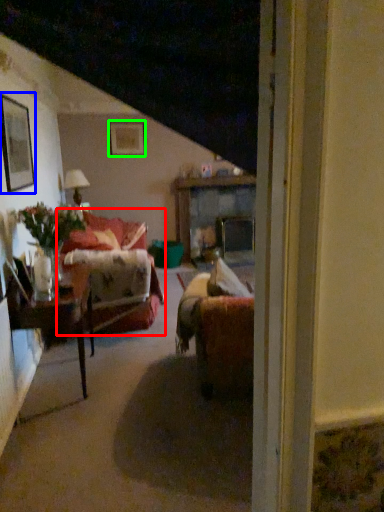
Question: Based on their relative distances, which object is farther from studio couch (highlighted by a red box)? Choose from picture frame (highlighted by a blue box) and picture frame (highlighted by a green box).

Choices:
 (A) picture frame
 (B) picture frame

Answer: (B)